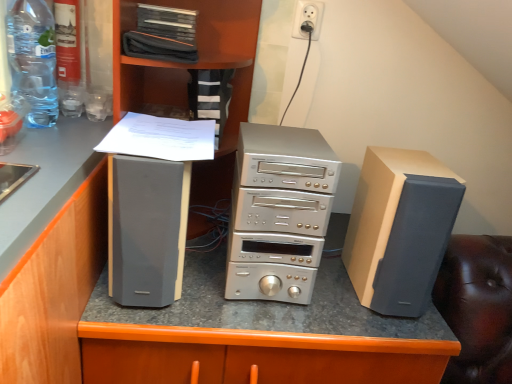
The image size is (512, 384). What are the coordinates of `free space in front of matte beige computer tower at right` in the screenshot? It's located at tap(380, 329).